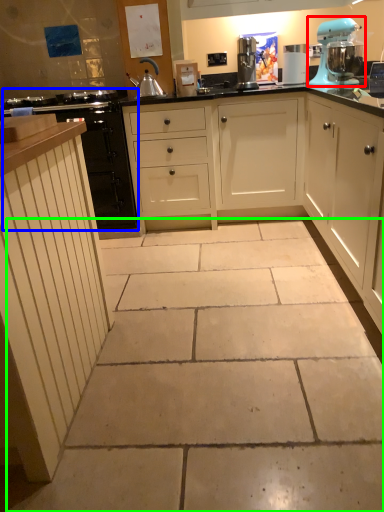
Question: Considering the real-world distances, which object is closest to home appliance (highlighted by a red box)? cabinetry (highlighted by a blue box) or concrete (highlighted by a green box).

Choices:
 (A) cabinetry
 (B) concrete

Answer: (A)